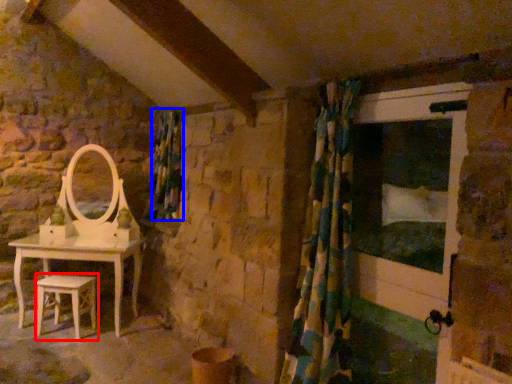
Question: Which point is closer to the camera, stool (highlighted by a red box) or curtain (highlighted by a blue box)?

Choices:
 (A) stool
 (B) curtain

Answer: (A)